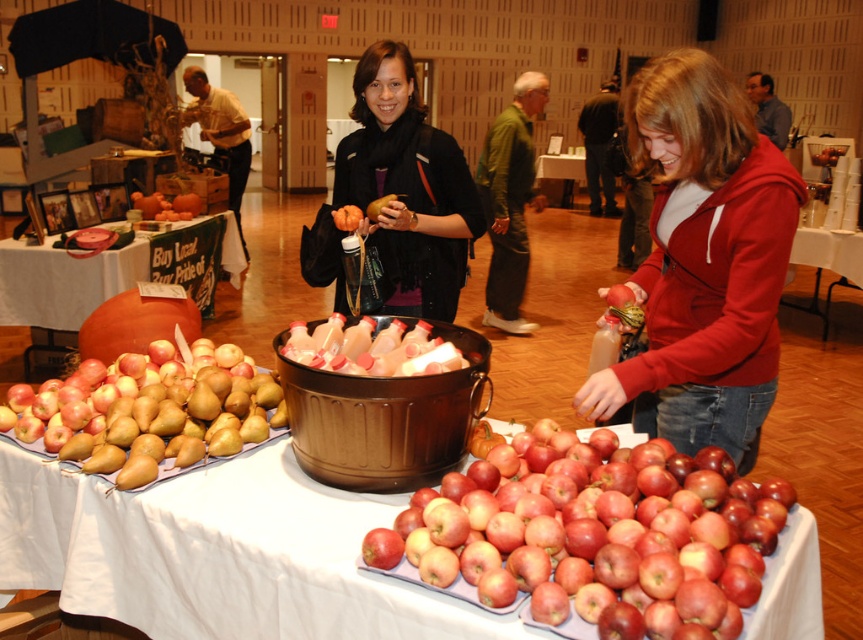
You are a customer at the market and want to pick up the golden brown pear at lower left and the orange rubber ball at center. Which item do you need to reach further to get?

The orange rubber ball at center requires reaching further because the golden brown pear at lower left is closer to the viewer.

You are a customer at the market and want to buy the shiny red apples at lower right. Where exactly are they located on the table?

The shiny red apples at lower right are located at point coordinates of (589, 534) on the table.

You are a customer at the market and want to reach the dark green jacket at center without disturbing the brushed metal water at bottle left. Can you walk around the table to the right side to get there?

The brushed metal water at bottle left is shorter than the dark green jacket at center, so you can walk around the table to the right side to reach the dark green jacket at center without the jacket blocking your path.